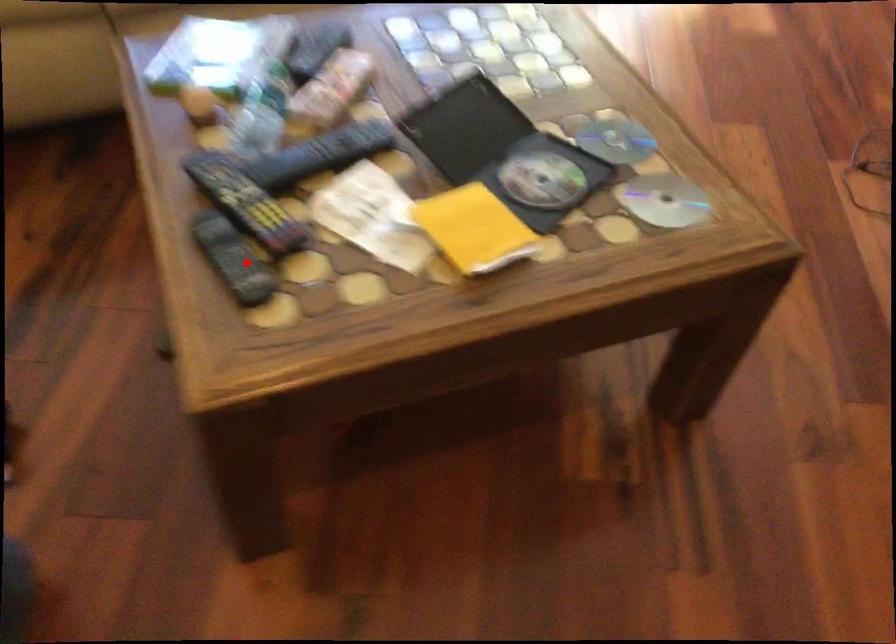
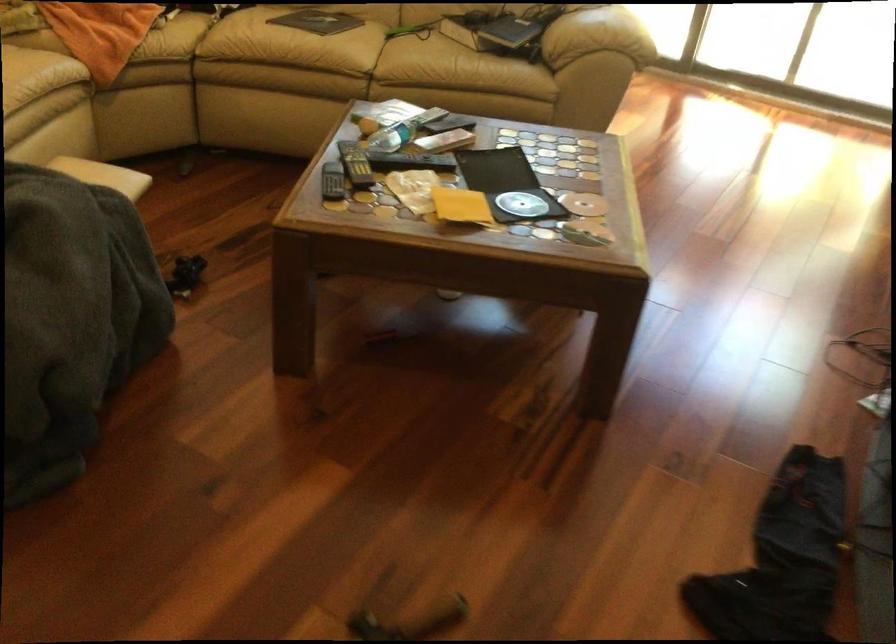
Question: A red point is marked in image1. In image2, is the corresponding 3D point closer to the camera or farther? Reply with the corresponding letter.

Choices:
 (A) The corresponding 3D point is closer.
 (B) The corresponding 3D point is farther.

Answer: (B)